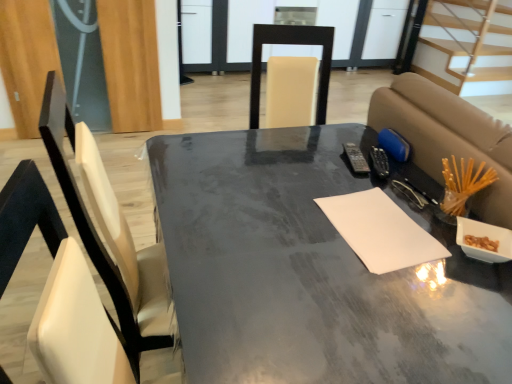
Measure the distance between point (232,179) and camera.

A distance of 4.12 feet exists between point (232,179) and camera.

The width and height of the screenshot is (512, 384). I want to click on white paper at center, so click(380, 231).

In order to face light wood stairs at upper right, should I rotate leftwards or rightwards?

To align with it, rotate right about 24.125°.

Identify the location of matte gray table at center. (311, 271).

Is there a large distance between matte gray table at center and white paper at center?

matte gray table at center is actually quite close to white paper at center.

How different are the orientations of matte gray table at center and white paper at center in degrees?

The facing directions of matte gray table at center and white paper at center are 2.79 degrees apart.

Would you say matte gray table at center is to the left or to the right of white paper at center in the picture?

matte gray table at center is positioned on white paper at center's left side.

Does matte gray table at center turn towards white paper at center?

No, matte gray table at center is not oriented towards white paper at center.

Is white paper at center oriented towards matte gray table at center?

Yes, white paper at center is aimed at matte gray table at center.

From a real-world perspective, which object stands above the other?

In real-world perspective, white paper at center is above.

In the image, is white paper at center positioned in front of or behind matte gray table at center?

Visually, white paper at center is located behind matte gray table at center.

Does point (390, 252) come closer to viewer compared to point (168, 174)?

Yes, point (390, 252) is closer to viewer.

Is white paper at center not within light wood stairs at upper right?

Absolutely, white paper at center is external to light wood stairs at upper right.

Are white paper at center and light wood stairs at upper right making contact?

No, white paper at center is not making contact with light wood stairs at upper right.

Based on their positions, is white paper at center located to the left or right of light wood stairs at upper right?

From the image, it's evident that white paper at center is to the left of light wood stairs at upper right.

Is light wood stairs at upper right turned away from matte gray table at center?

No, light wood stairs at upper right is not facing the opposite direction of matte gray table at center.

Is matte gray table at center surrounded by light wood stairs at upper right?

No, matte gray table at center is located outside of light wood stairs at upper right.

Considering the relative sizes of light wood stairs at upper right and matte gray table at center in the image provided, is light wood stairs at upper right shorter than matte gray table at center?

Indeed, light wood stairs at upper right has a lesser height compared to matte gray table at center.

From a real-world perspective, is light wood stairs at upper right beneath matte gray table at center?

Actually, light wood stairs at upper right is physically above matte gray table at center in the real world.

How distant is light wood stairs at upper right from white paper at center?

light wood stairs at upper right is 3.62 meters away from white paper at center.

Relative to white paper at center, is light wood stairs at upper right in front or behind?

light wood stairs at upper right is behind white paper at center.

From the image's perspective, which is below, light wood stairs at upper right or white paper at center?

white paper at center, from the image's perspective.

Is white paper at center surrounded by light wood stairs at upper right?

No, white paper at center is not a part of light wood stairs at upper right.

Which is closer to the camera, (464,356) or (470,33)?

The point (464,356) is closer.

From the image's perspective, would you say matte gray table at center is shown under light wood stairs at upper right?

Yes.

What's the angular difference between matte gray table at center and light wood stairs at upper right's facing directions?

The angle between the facing direction of matte gray table at center and the facing direction of light wood stairs at upper right is 92 degrees.

Does matte gray table at center have a larger size compared to light wood stairs at upper right?

Yes.

Locate an element on the screen. The image size is (512, 384). table that is below the white paper at center (from the image's perspective) is located at coordinates tap(311, 271).

The height and width of the screenshot is (384, 512). Identify the location of table in front of the white paper at center. (311, 271).

When comparing their distances from white paper at center, does light wood stairs at upper right or matte gray table at center seem further?

light wood stairs at upper right is further to white paper at center.

Based on the photo, based on their spatial positions, is white paper at center or light wood stairs at upper right further from matte gray table at center?

light wood stairs at upper right lies further to matte gray table at center than the other object.

Based on their spatial positions, is light wood stairs at upper right or white paper at center closer to matte gray table at center?

white paper at center is positioned closer to the anchor matte gray table at center.

Considering their positions, is white paper at center positioned further to light wood stairs at upper right than matte gray table at center?

Based on the image, white paper at center appears to be further to light wood stairs at upper right.

Which object lies nearer to the anchor point light wood stairs at upper right, matte gray table at center or white paper at center?

matte gray table at center lies closer to light wood stairs at upper right than the other object.

Considering their positions, is matte gray table at center positioned further to white paper at center than light wood stairs at upper right?

Among the two, light wood stairs at upper right is located further to white paper at center.

What are the coordinates of `notepad between matte gray table at center and light wood stairs at upper right from front to back` in the screenshot? It's located at (380, 231).